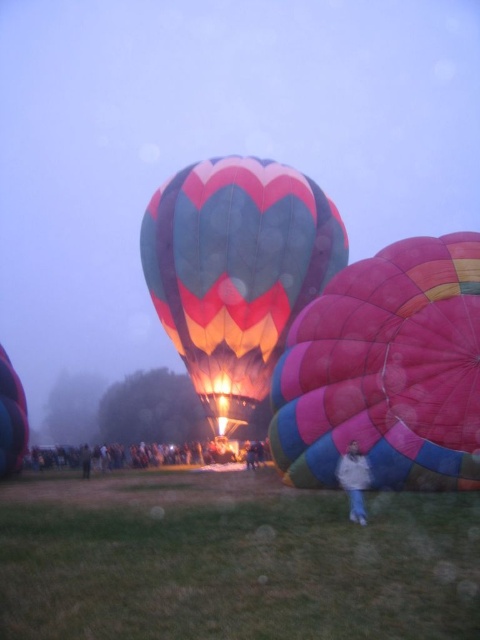
Question: Among these objects, which one is nearest to the camera?

Choices:
 (A) matte pink balloon at left
 (B) green grass at lower center
 (C) multicolored fabric hot air balloon at center

Answer: (B)

Question: Based on their relative distances, which object is farther from the multicolored fabric hot air balloon at center?

Choices:
 (A) matte pink balloon at left
 (B) multicolored fabric balloon at center

Answer: (A)

Question: Where is multicolored fabric balloon at center located in relation to white cotton jacket at lower center in the image?

Choices:
 (A) right
 (B) left

Answer: (A)

Question: Can you confirm if green grass at lower center is positioned to the right of white cotton jacket at lower center?

Choices:
 (A) yes
 (B) no

Answer: (B)

Question: Among these objects, which one is nearest to the camera?

Choices:
 (A) multicolored fabric balloon at center
 (B) white cotton jacket at lower center
 (C) matte pink balloon at left

Answer: (B)

Question: Is the position of multicolored fabric balloon at center less distant than that of white cotton jacket at lower center?

Choices:
 (A) no
 (B) yes

Answer: (A)